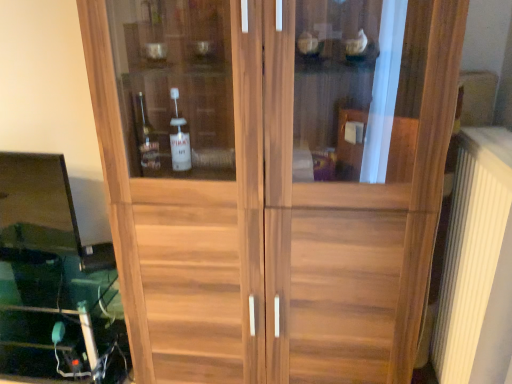
This screenshot has height=384, width=512. In order to click on white ribbed radiator at right in this screenshot , I will do `click(477, 264)`.

The height and width of the screenshot is (384, 512). What do you see at coordinates (477, 264) in the screenshot?
I see `white ribbed radiator at right` at bounding box center [477, 264].

Where is `white ribbed radiator at right`? This screenshot has height=384, width=512. white ribbed radiator at right is located at coordinates (477, 264).